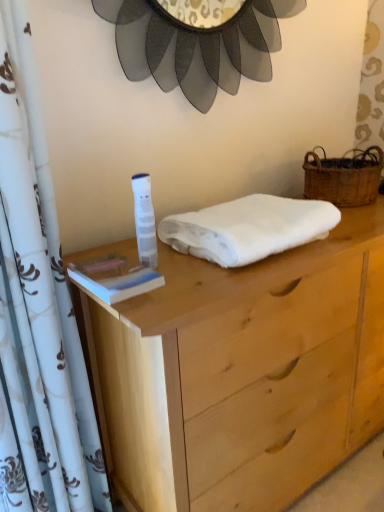
This screenshot has width=384, height=512. What are the coordinates of `empty space that is to the right of white plastic tube at center` in the screenshot? It's located at (206, 267).